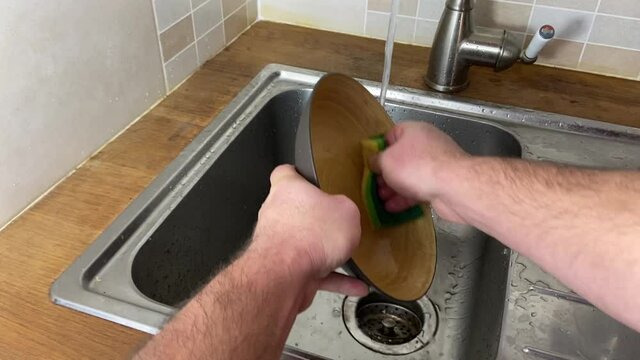
Image resolution: width=640 pixels, height=360 pixels. In order to click on tap in this screenshot , I will do `click(452, 38)`.